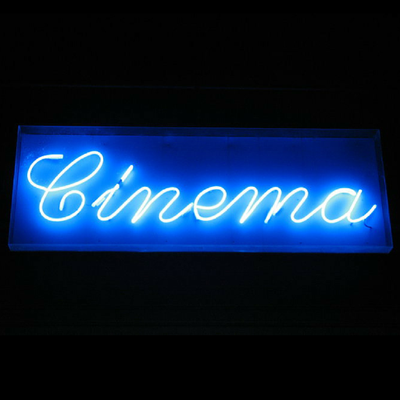
What are the coordinates of `top left corner of neon sign` in the screenshot? It's located at (23, 126).